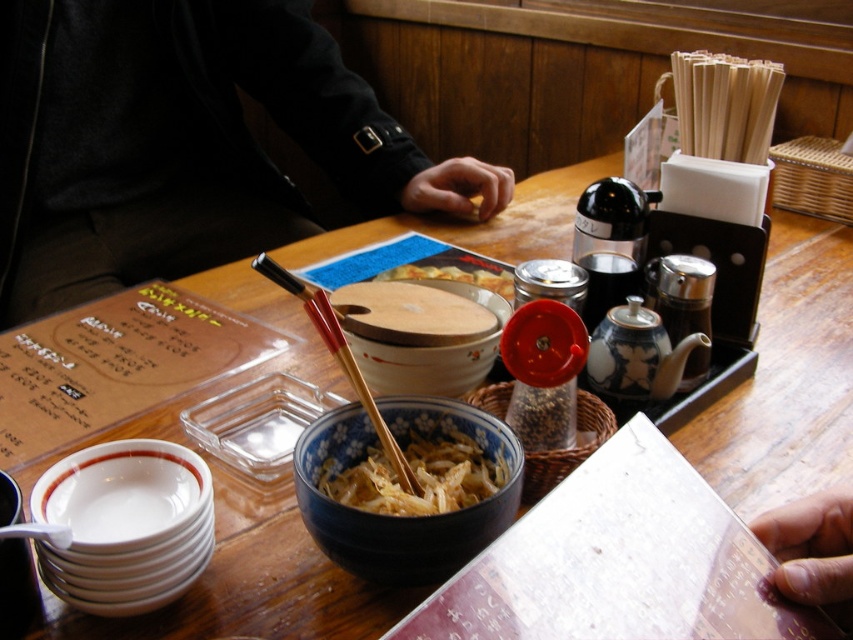
Is point (366, 321) behind point (426, 355)?

Yes, it is behind point (426, 355).

Which is behind, point (436, 312) or point (473, 368)?

Positioned behind is point (436, 312).

Where is `wooden bowl at center`? The image size is (853, 640). wooden bowl at center is located at coordinates (410, 314).

Does point (492, 460) lie behind point (828, 609)?

Yes.

Based on the photo, which is more to the right, blue ceramic bowl at center or finger at upper right?

finger at upper right

Locate an element on the screen. This screenshot has width=853, height=640. blue ceramic bowl at center is located at coordinates (402, 516).

Does dark gray sweater at upper left lie behind wooden bowl at center?

Yes.

Which is above, dark gray sweater at upper left or wooden bowl at center?

dark gray sweater at upper left is higher up.

Who is more distant from viewer, (167, 136) or (387, 305)?

Positioned behind is point (167, 136).

The image size is (853, 640). I want to click on dark gray sweater at upper left, so click(184, 144).